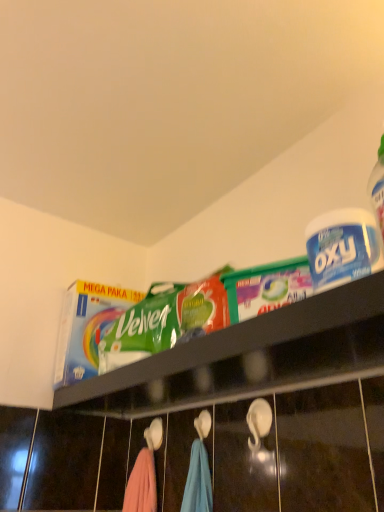
Locate an element on the screen. The height and width of the screenshot is (512, 384). unoccupied space behind white plastic container at upper right is located at coordinates (317, 331).